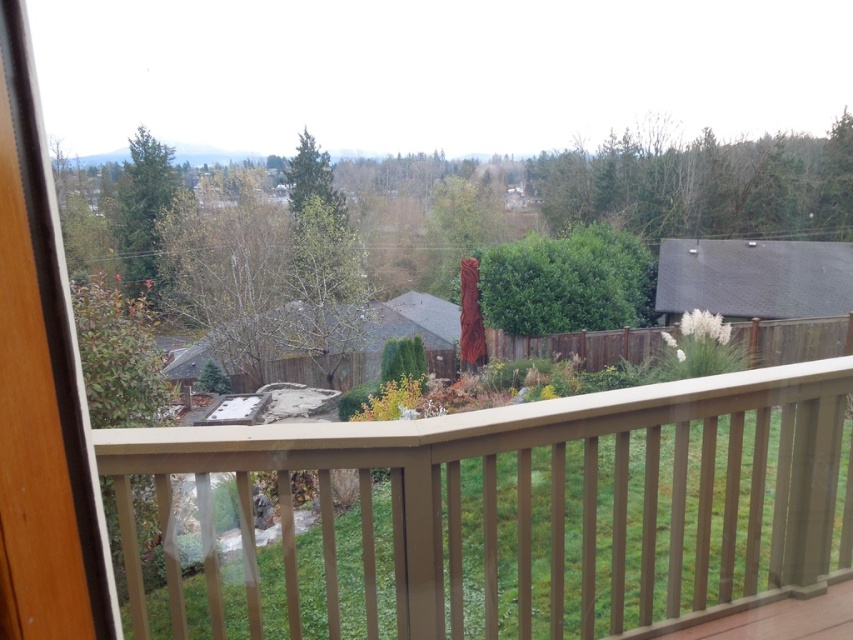
Question: Can you confirm if brown wood railing at lower center is positioned above green leafy tree at upper right?

Choices:
 (A) yes
 (B) no

Answer: (B)

Question: Is brown wooden screen door at left to the right of green matte tree at upper left from the viewer's perspective?

Choices:
 (A) yes
 (B) no

Answer: (A)

Question: Which object appears closest to the camera in this image?

Choices:
 (A) brown wooden screen door at left
 (B) green matte tree at upper left
 (C) brown wood railing at lower center

Answer: (A)

Question: Estimate the real-world distances between objects in this image. Which object is closer to the green leafy tree at upper right?

Choices:
 (A) brown wood railing at lower center
 (B) brown wooden screen door at left
 (C) green matte tree at upper left

Answer: (C)

Question: Does brown wood railing at lower center have a greater width compared to green matte tree at upper left?

Choices:
 (A) yes
 (B) no

Answer: (B)

Question: Which of these objects is positioned closest to the green leafy tree at upper right?

Choices:
 (A) brown wooden screen door at left
 (B) brown wood railing at lower center

Answer: (B)